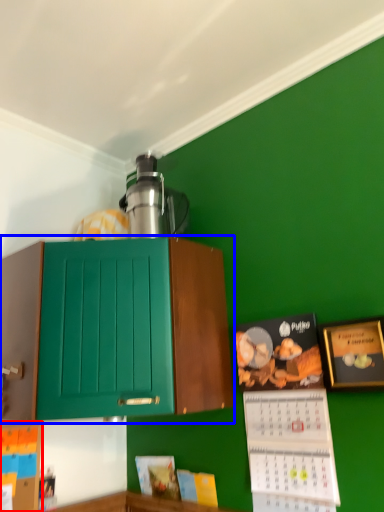
Question: Which object appears closest to the camera in this image, book (highlighted by a red box) or cabinetry (highlighted by a blue box)?

Choices:
 (A) book
 (B) cabinetry

Answer: (B)